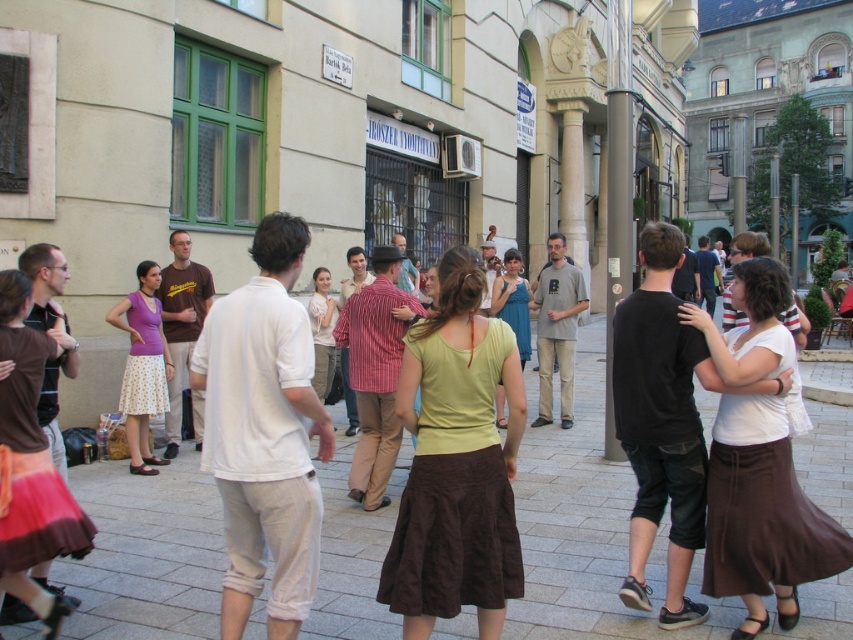
Question: From the image, what is the correct spatial relationship of green cotton shirt at center in relation to matte purple tank top at left?

Choices:
 (A) above
 (B) below

Answer: (B)

Question: Which of the following is the closest to the observer?

Choices:
 (A) white cotton shirt at center
 (B) green cotton shirt at center
 (C) brown fabric skirt at center
 (D) matte purple tank top at left

Answer: (A)

Question: Which of these objects is positioned farthest from the matte purple tank top at left?

Choices:
 (A) white cotton shirt at center
 (B) green cotton shirt at center
 (C) brown fabric skirt at center

Answer: (B)

Question: Which point is closer to the camera?

Choices:
 (A) (163, 394)
 (B) (488, 477)
 (C) (231, 404)

Answer: (C)

Question: Can you confirm if green cotton shirt at center is positioned below white cotton shirt at center?

Choices:
 (A) yes
 (B) no

Answer: (A)

Question: Is brown fabric skirt at center wider than green cotton shirt at center?

Choices:
 (A) no
 (B) yes

Answer: (A)